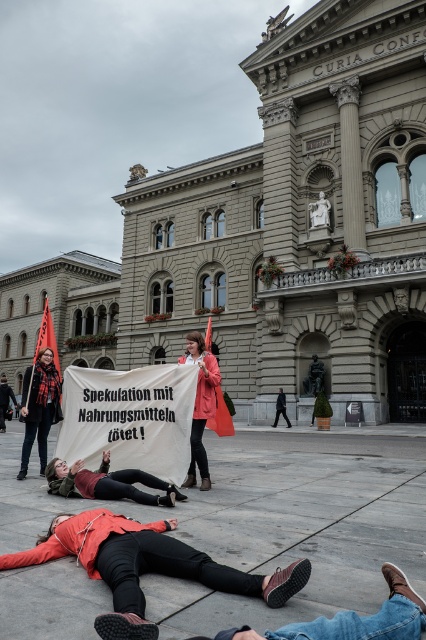
Can you confirm if leather jacket at lower center is positioned above matte black scarf at left?

Actually, leather jacket at lower center is below matte black scarf at left.

In order to click on leather jacket at lower center in this screenshot , I will do `click(108, 483)`.

Where is `leather jacket at lower center`? leather jacket at lower center is located at coordinates tap(108, 483).

Does leather jacket at lower center have a larger size compared to matte pink coat at center?

Actually, leather jacket at lower center might be smaller than matte pink coat at center.

Can you confirm if leather jacket at lower center is positioned above matte pink coat at center?

No, leather jacket at lower center is not above matte pink coat at center.

At what (x,y) coordinates should I click in order to perform the action: click on leather jacket at lower center. Please return your answer as a coordinate pair (x, y). This screenshot has width=426, height=640. Looking at the image, I should click on (108, 483).

Which is above, matte black scarf at left or matte pink coat at center?

matte pink coat at center is above.

Which is more to the right, matte black scarf at left or matte pink coat at center?

matte pink coat at center

Which is in front, point (40, 436) or point (201, 449)?

Positioned in front is point (201, 449).

This screenshot has height=640, width=426. I want to click on matte black scarf at left, so click(x=40, y=406).